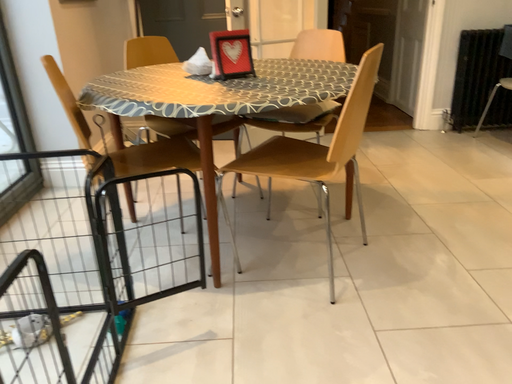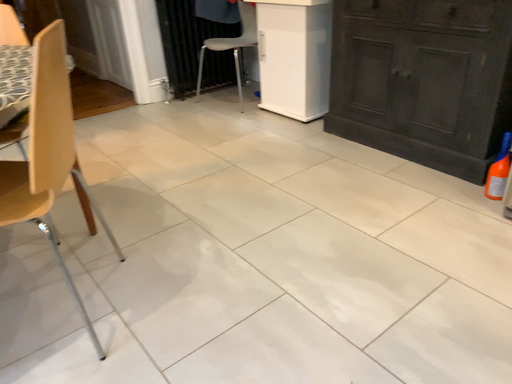
Question: Which way did the camera rotate in the video?

Choices:
 (A) rotated right
 (B) rotated left

Answer: (A)